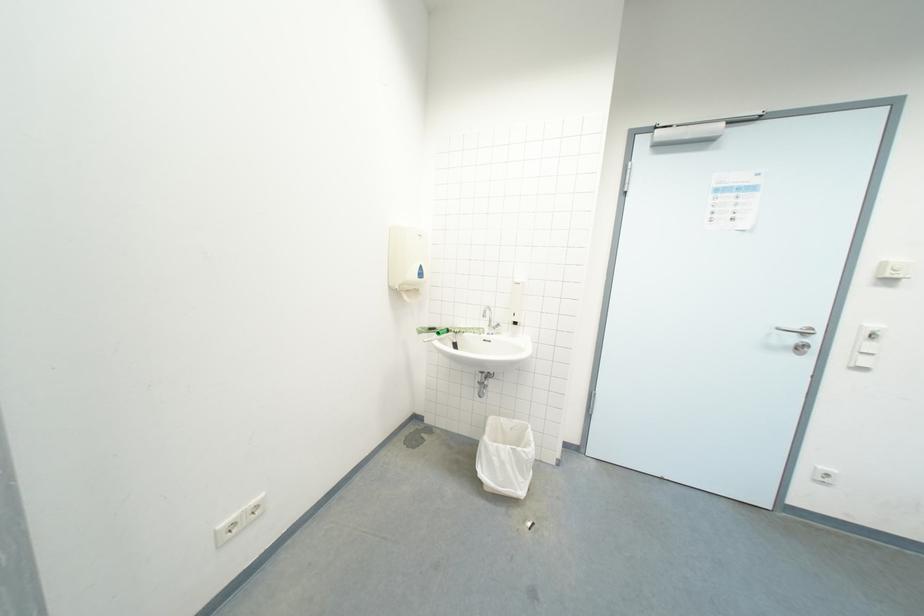
Identify the location of faucet handle. (488, 315).